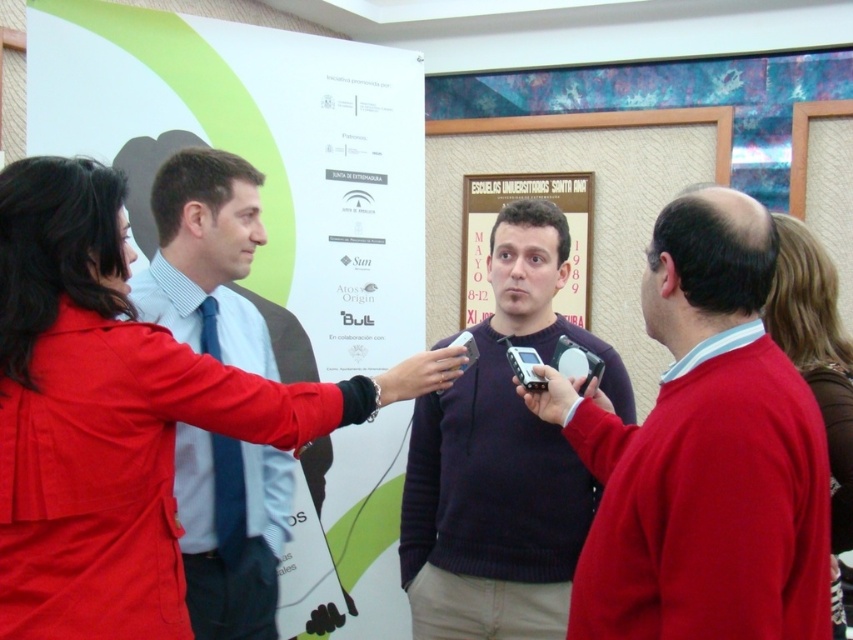
Does white paper poster at center have a larger size compared to light blue shirt at center?

Indeed, white paper poster at center has a larger size compared to light blue shirt at center.

Between point (289, 184) and point (207, 589), which one is positioned in front?

Positioned in front is point (207, 589).

What are the coordinates of `white paper poster at center` in the screenshot? It's located at (258, 157).

Which is in front, point (358, 445) or point (485, 298)?

Positioned in front is point (358, 445).

Is white paper poster at center bigger than matte paper poster at center?

Indeed, white paper poster at center has a larger size compared to matte paper poster at center.

Is point (407, 102) farther from camera compared to point (579, 208)?

That is False.

The width and height of the screenshot is (853, 640). I want to click on white paper poster at center, so click(x=258, y=157).

From the picture: Does dark purple sweater at center have a lesser height compared to light blue shirt at center?

Indeed, dark purple sweater at center has a lesser height compared to light blue shirt at center.

Between dark purple sweater at center and light blue shirt at center, which one is positioned lower?

dark purple sweater at center is lower down.

Is point (509, 202) closer to camera compared to point (157, 266)?

No, it is behind (157, 266).

At what (x,y) coordinates should I click in order to perform the action: click on dark purple sweater at center. Please return your answer as a coordinate pair (x, y). The height and width of the screenshot is (640, 853). Looking at the image, I should click on (502, 460).